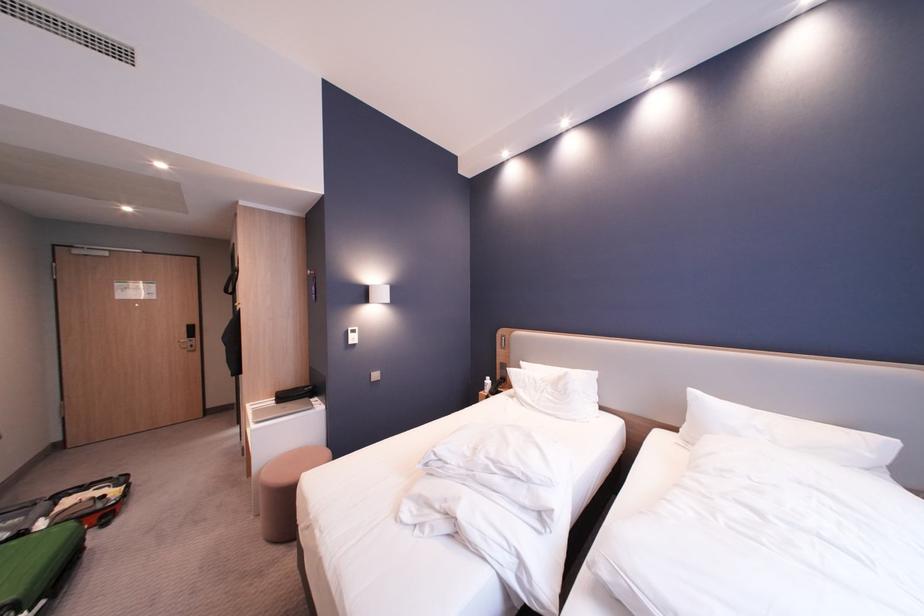
Where would you lift the green suitcase? Please return your answer as a coordinate pair (x, y).

(38, 567)